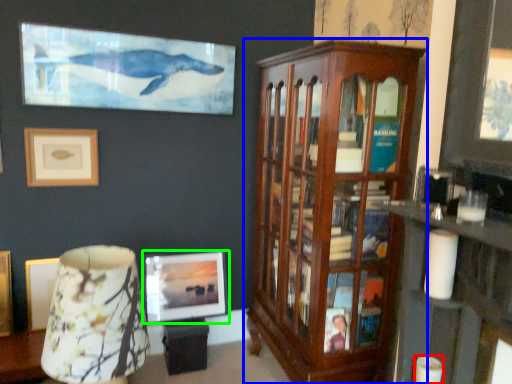
Question: Based on their relative distances, which object is nearer to candle (highlighted by a red box)? Choose from cabinetry (highlighted by a blue box) and picture frame (highlighted by a green box).

Choices:
 (A) cabinetry
 (B) picture frame

Answer: (A)